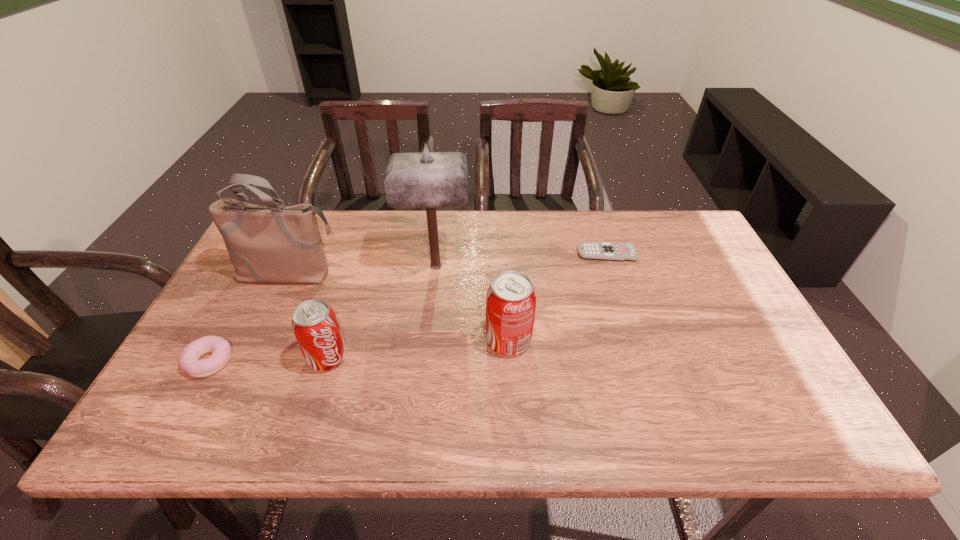
The height and width of the screenshot is (540, 960). I want to click on the left soda, so click(315, 325).

Where is `the third shortest object`? the third shortest object is located at coordinates (315, 325).

This screenshot has width=960, height=540. Identify the location of the fifth object from left to right. (511, 298).

Where is `the third tallest object`? This screenshot has width=960, height=540. the third tallest object is located at coordinates (511, 298).

This screenshot has width=960, height=540. I want to click on shoulder bag, so click(275, 243).

Find the location of a particular element. This screenshot has height=540, width=960. the third object from right to left is located at coordinates (430, 180).

In order to click on remote control in this screenshot , I will do `click(613, 251)`.

You are a GUI agent. You are given a task and a screenshot of the screen. Output one action in this format:
    pyautogui.click(x=<x>, y=<y>)
    Task: Click on the shortest object
    The height and width of the screenshot is (540, 960).
    Given the screenshot: What is the action you would take?
    pyautogui.click(x=613, y=251)

At what (x,y) coordinates should I click in order to perform the action: click on the fifth tallest object. Please return your answer as a coordinate pair (x, y). Looking at the image, I should click on (189, 360).

The height and width of the screenshot is (540, 960). I want to click on vacant space located on the left of the shorter soda, so click(x=204, y=358).